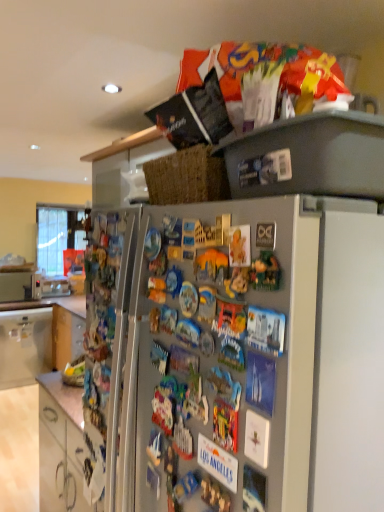
Question: Is there a large distance between metallic silver microwave at left and white glossy cabinet at lower left, which ranks as the first cabinetry in top-to-bottom order?

Choices:
 (A) no
 (B) yes

Answer: (A)

Question: Is the depth of metallic silver microwave at left less than that of white glossy cabinet at lower left, which is counted as the second cabinetry, starting from the bottom?

Choices:
 (A) no
 (B) yes

Answer: (A)

Question: From a real-world perspective, is metallic silver microwave at left positioned over white glossy cabinet at lower left, which ranks as the first cabinetry in top-to-bottom order, based on gravity?

Choices:
 (A) no
 (B) yes

Answer: (B)

Question: Is white glossy cabinet at lower left, which ranks as the first cabinetry in top-to-bottom order, completely or partially inside metallic silver microwave at left?

Choices:
 (A) no
 (B) yes

Answer: (A)

Question: Is metallic silver microwave at left smaller than white glossy cabinet at lower left, which is counted as the first cabinetry, starting from the back?

Choices:
 (A) yes
 (B) no

Answer: (A)

Question: Looking at the image, does white glossy cabinet at lower left, which ranks as the first cabinetry in top-to-bottom order, seem bigger or smaller compared to metallic silver microwave at left?

Choices:
 (A) big
 (B) small

Answer: (A)

Question: Considering the positions of white glossy cabinet at lower left, which is counted as the second cabinetry, starting from the bottom, and metallic silver microwave at left in the image, is white glossy cabinet at lower left, which is counted as the second cabinetry, starting from the bottom, taller or shorter than metallic silver microwave at left?

Choices:
 (A) tall
 (B) short

Answer: (A)

Question: Is point (3, 360) closer or farther from the camera than point (18, 288)?

Choices:
 (A) farther
 (B) closer

Answer: (B)

Question: Visually, is white glossy cabinet at lower left, which ranks as the first cabinetry in top-to-bottom order, positioned to the left or to the right of metallic silver microwave at left?

Choices:
 (A) left
 (B) right

Answer: (B)

Question: Does point (59, 452) appear closer or farther from the camera than point (11, 296)?

Choices:
 (A) closer
 (B) farther

Answer: (A)

Question: Is white glossy cabinet at lower left, which appears as the first cabinetry when viewed from the front, in front of or behind metallic silver microwave at left in the image?

Choices:
 (A) front
 (B) behind

Answer: (A)

Question: Considering the positions of white glossy cabinet at lower left, acting as the second cabinetry starting from the top, and metallic silver microwave at left in the image, is white glossy cabinet at lower left, acting as the second cabinetry starting from the top, wider or thinner than metallic silver microwave at left?

Choices:
 (A) thin
 (B) wide

Answer: (B)

Question: In terms of height, does white glossy cabinet at lower left, which appears as the first cabinetry when viewed from the front, look taller or shorter compared to metallic silver microwave at left?

Choices:
 (A) short
 (B) tall

Answer: (A)

Question: Which is correct: metallic silver microwave at left is inside white glossy cabinet at lower left, which appears as the first cabinetry when viewed from the front, or outside of it?

Choices:
 (A) outside
 (B) inside

Answer: (A)

Question: From a real-world perspective, is metallic silver microwave at left physically located above or below white glossy cabinet at lower left, positioned as the 2th cabinetry in back-to-front order?

Choices:
 (A) below
 (B) above

Answer: (B)